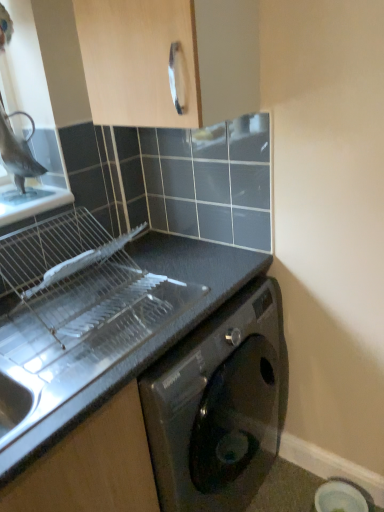
Question: Does black matte countertop at lower left appear on the left side of matte black washing machine at lower right?

Choices:
 (A) yes
 (B) no

Answer: (A)

Question: Is black matte countertop at lower left facing away from matte black washing machine at lower right?

Choices:
 (A) yes
 (B) no

Answer: (B)

Question: Can you confirm if black matte countertop at lower left is bigger than matte black washing machine at lower right?

Choices:
 (A) no
 (B) yes

Answer: (B)

Question: Can you confirm if black matte countertop at lower left is smaller than matte black washing machine at lower right?

Choices:
 (A) yes
 (B) no

Answer: (B)

Question: Can you confirm if black matte countertop at lower left is wider than matte black washing machine at lower right?

Choices:
 (A) no
 (B) yes

Answer: (B)

Question: From a real-world perspective, is light wood cabinet handle at upper center above or below black matte countertop at lower left?

Choices:
 (A) above
 (B) below

Answer: (A)

Question: Visually, is light wood cabinet handle at upper center positioned to the left or to the right of black matte countertop at lower left?

Choices:
 (A) right
 (B) left

Answer: (A)

Question: Is point (226, 67) positioned closer to the camera than point (11, 470)?

Choices:
 (A) closer
 (B) farther

Answer: (B)

Question: In the image, is light wood cabinet handle at upper center positioned in front of or behind black matte countertop at lower left?

Choices:
 (A) behind
 (B) front

Answer: (B)

Question: From a real-world perspective, is black matte countertop at lower left physically located above or below light wood cabinet handle at upper center?

Choices:
 (A) above
 (B) below

Answer: (B)

Question: From their relative heights in the image, would you say black matte countertop at lower left is taller or shorter than light wood cabinet handle at upper center?

Choices:
 (A) tall
 (B) short

Answer: (A)

Question: Visually, is black matte countertop at lower left positioned to the left or to the right of light wood cabinet handle at upper center?

Choices:
 (A) left
 (B) right

Answer: (A)

Question: Considering the positions of black matte countertop at lower left and light wood cabinet handle at upper center in the image, is black matte countertop at lower left wider or thinner than light wood cabinet handle at upper center?

Choices:
 (A) thin
 (B) wide

Answer: (B)

Question: Is black matte countertop at lower left taller or shorter than matte black washing machine at lower right?

Choices:
 (A) short
 (B) tall

Answer: (B)

Question: Which is correct: black matte countertop at lower left is inside matte black washing machine at lower right, or outside of it?

Choices:
 (A) inside
 (B) outside

Answer: (B)